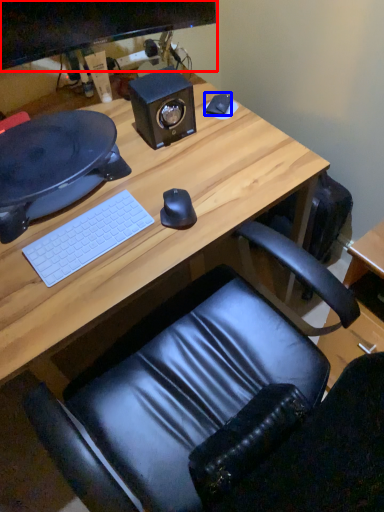
Question: Which of the following is the farthest to the observer, computer monitor (highlighted by a red box) or notepad (highlighted by a blue box)?

Choices:
 (A) computer monitor
 (B) notepad

Answer: (B)